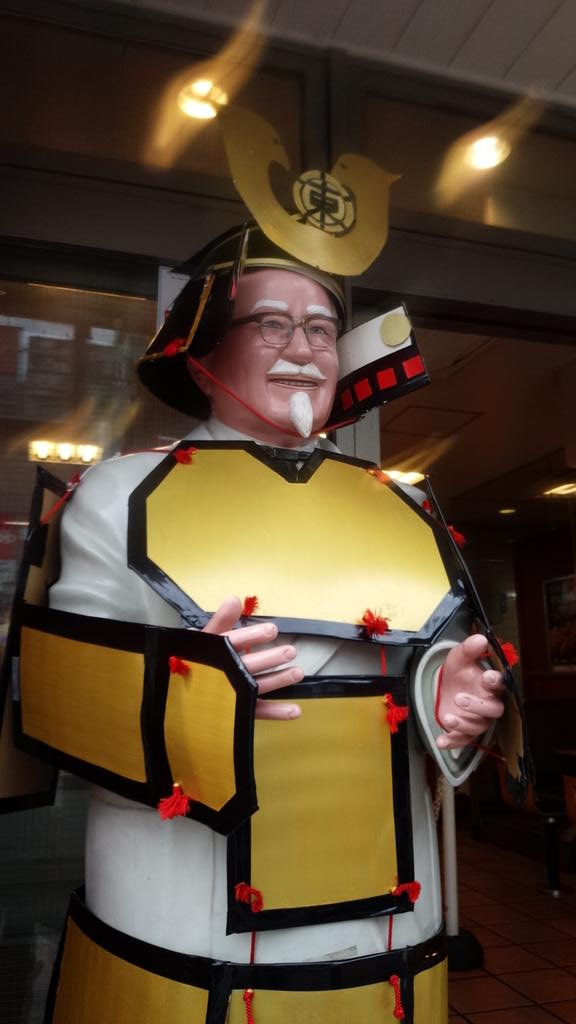
The width and height of the screenshot is (576, 1024). Identify the location of window. click(45, 402).